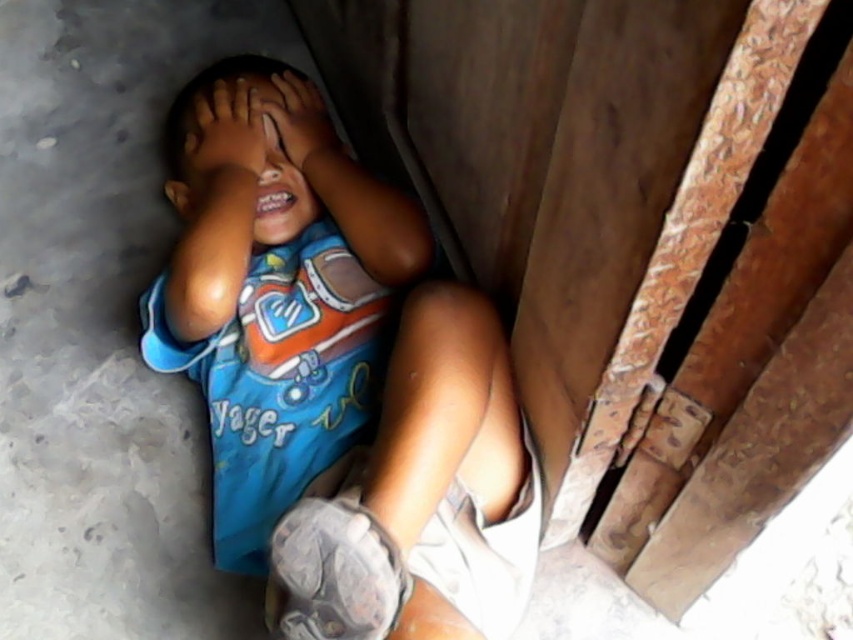
You are a drone operator trying to deliver a small package to the blue fabric head at center in the image. The delivery point is marked as point (236, 144). Is the delivery point on the blue fabric head at center?

Yes, the delivery point (236, 144) is on the blue fabric head at center according to the description.

Based on the photo, you are a photographer taking a picture of the blue fabric head at center and the brown matte eye at center. Which object should you focus on first if you want to capture both in sharp focus, considering their sizes?

The blue fabric head at center is wider than the brown matte eye at center, so focusing on the blue fabric head at center would ensure both are in sharp focus as it is larger and occupies more space in the frame.